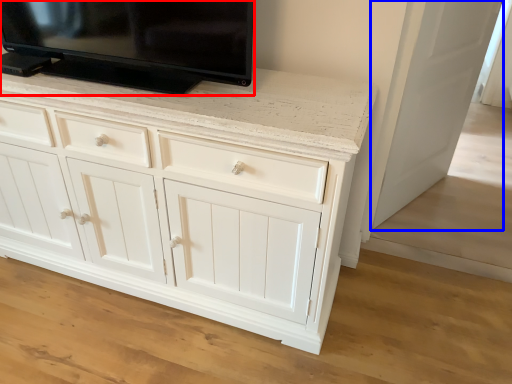
Question: Which of the following is the closest to the observer, television (highlighted by a red box) or door (highlighted by a blue box)?

Choices:
 (A) television
 (B) door

Answer: (A)